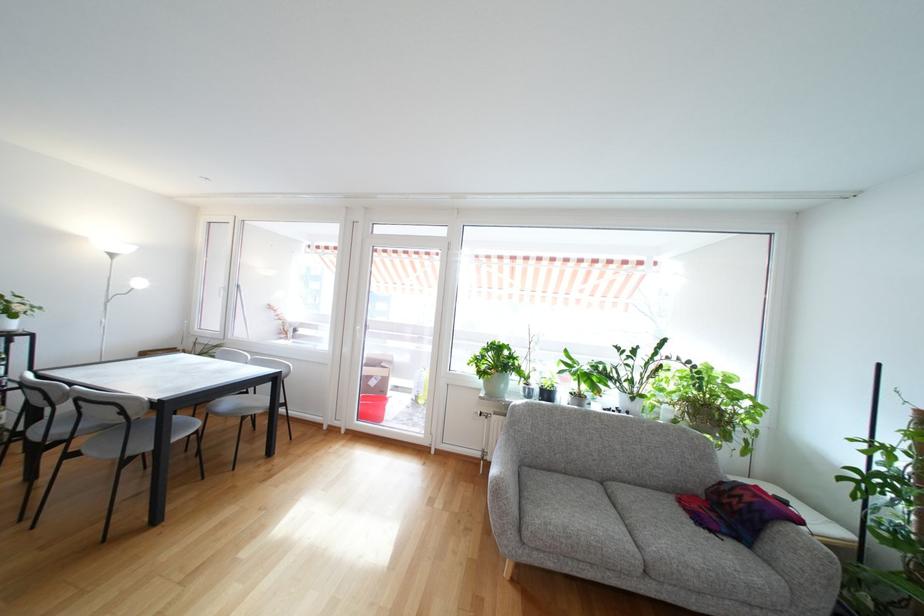
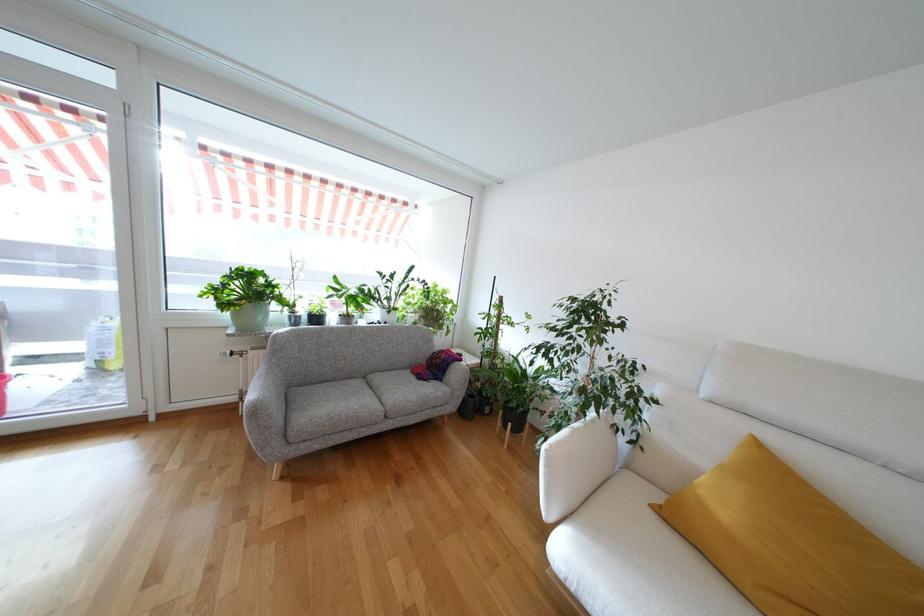
The point at (523, 505) is marked in the first image. Where is the corresponding point in the second image?

(290, 418)